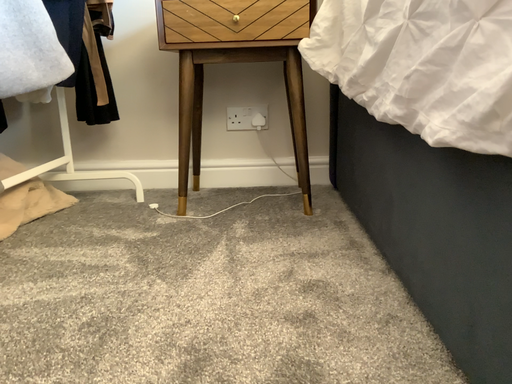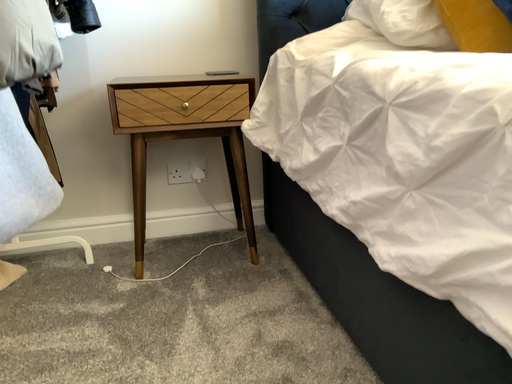
Question: Which way did the camera rotate in the video?

Choices:
 (A) rotated right
 (B) rotated left

Answer: (A)